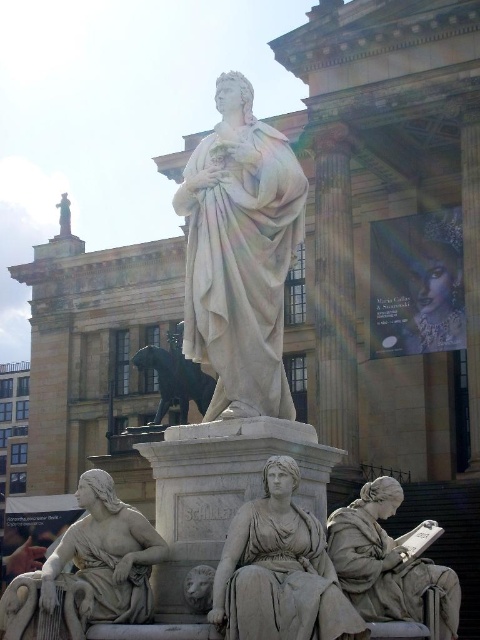
You are standing in front of the building and see the white marble statue at center and the matte stone lion at lower center. Which object is positioned to the left of the other?

The matte stone lion at lower center is positioned to the left of the white marble statue at center.

You are standing at the camera position and want to take a photo of the matte gray statue at lower right. If your camera has a maximum focus range of 80 feet, will you be able to capture the statue clearly?

The matte gray statue at lower right is 80.51 feet away from the camera. Since the statue is slightly beyond the camera maximum focus range of 80 feet, the statue will be out of focus and not captured clearly.